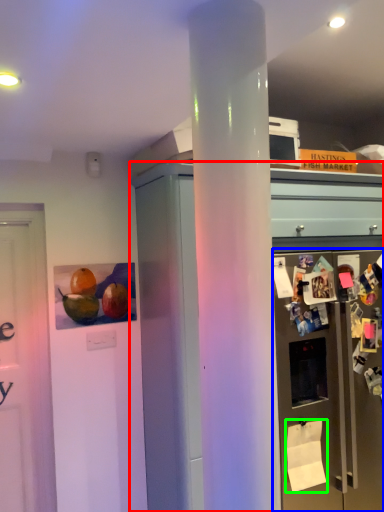
Question: Estimate the real-world distances between objects in this image. Which object is closer to cabinetry (highlighted by a red box), refrigerator (highlighted by a blue box) or toilet paper (highlighted by a green box)?

Choices:
 (A) refrigerator
 (B) toilet paper

Answer: (A)